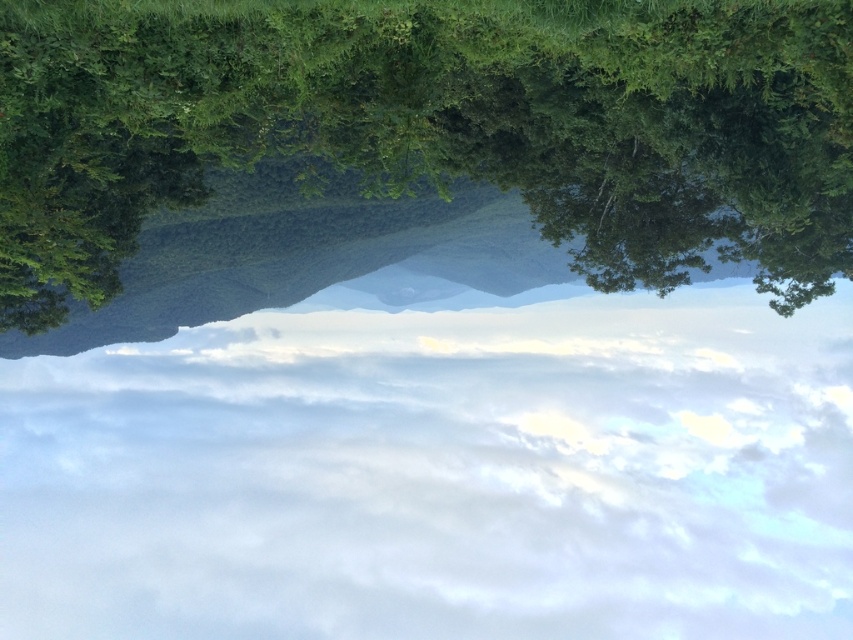
You are a bird soaring in the sky and you see the white fluffy cloud at center and the green leafy tree at upper center. Which one is higher up in the sky?

The white fluffy cloud at center is taller than the green leafy tree at upper center, so the white fluffy cloud at center is higher up in the sky.